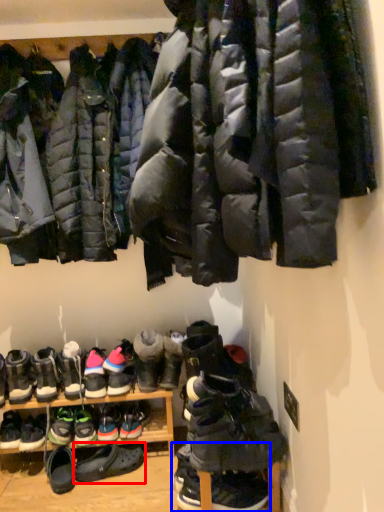
Question: Which object is closer to the camera taking this photo, footwear (highlighted by a red box) or footwear (highlighted by a blue box)?

Choices:
 (A) footwear
 (B) footwear

Answer: (B)